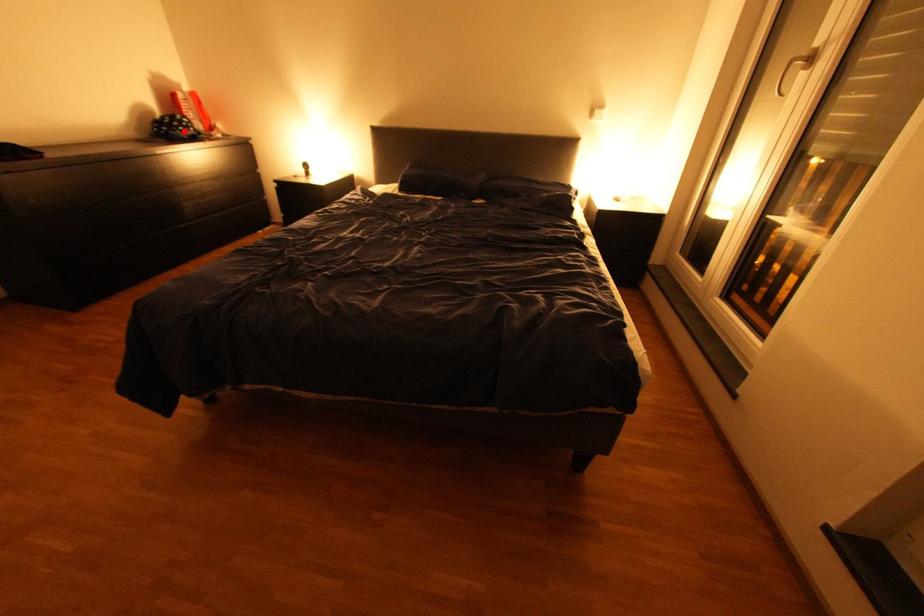
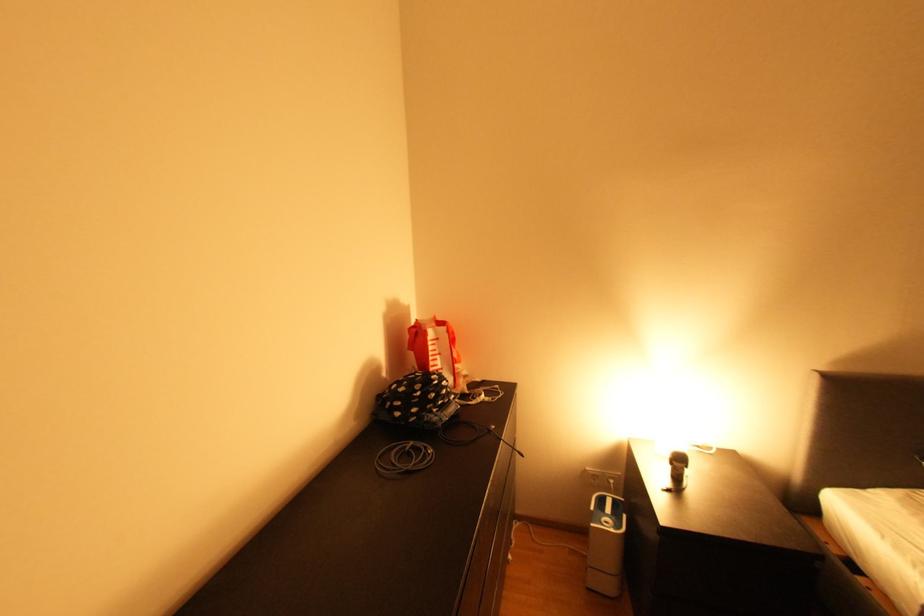
Where in the second image is the point corresponding to the highlighted location from the first image?

(441, 411)